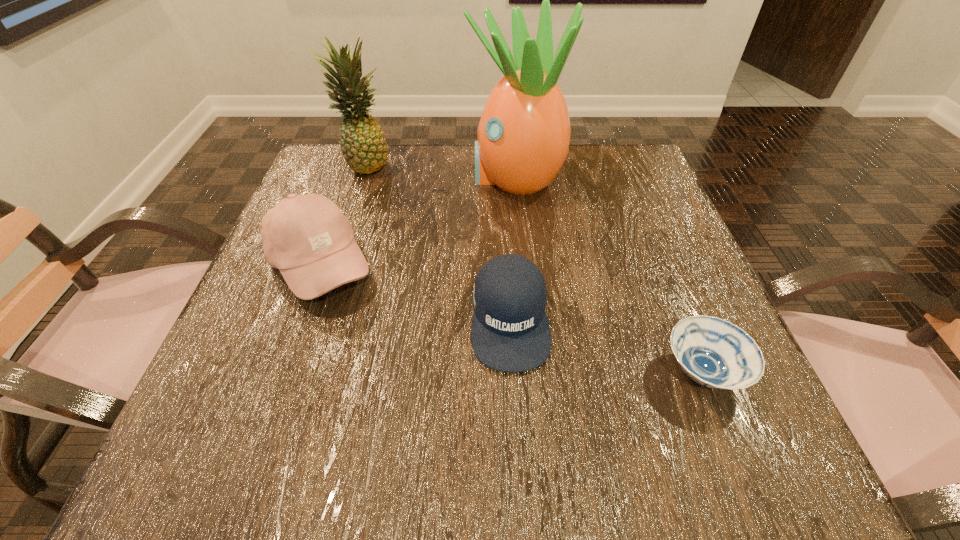
Where is `vacant space situated at the entrance of the tallest object`? The height and width of the screenshot is (540, 960). vacant space situated at the entrance of the tallest object is located at coordinates (360, 177).

Identify the location of vacant space situated 0.170m at the entrance of the tallest object. (395, 177).

This screenshot has width=960, height=540. Find the location of `free space located 0.090m at the entrance of the tallest object`. free space located 0.090m at the entrance of the tallest object is located at coordinates (429, 177).

Identify the location of vacant space located on the right of the shorter pineapple. This screenshot has height=540, width=960. (451, 164).

Identify the location of free location located on the front-facing side of the taller baseball cap. (564, 265).

Find the location of a particular element. The height and width of the screenshot is (540, 960). vacant region located 0.060m on the front-facing side of the right baseball cap is located at coordinates (516, 412).

Locate an element on the screen. The image size is (960, 540). free spot located 0.050m on the left of the soup bowl is located at coordinates (628, 372).

Locate an element on the screen. This screenshot has height=540, width=960. pineapple that is at the left edge is located at coordinates (362, 141).

Find the location of a particular element. The image size is (960, 540). baseball cap present at the left edge is located at coordinates (307, 237).

Find the location of a particular element. The image size is (960, 540). object that is positioned at the right edge is located at coordinates (715, 353).